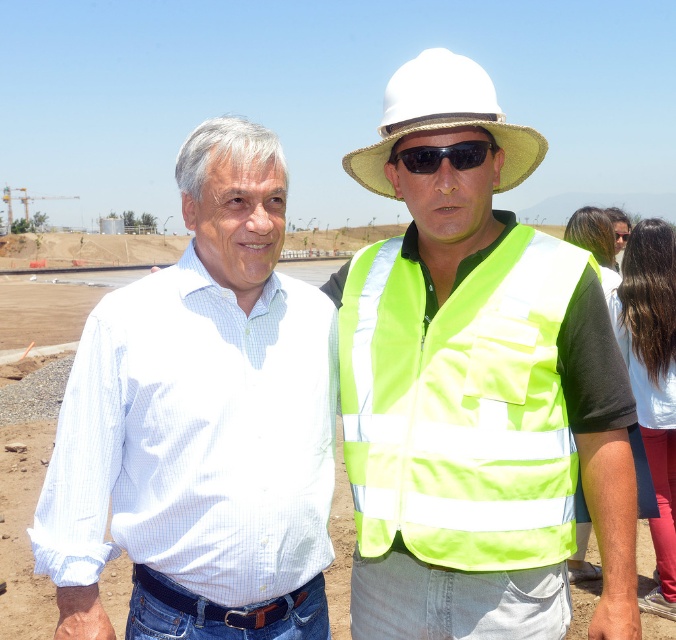
Question: Can you confirm if reflective yellow vest at center is bigger than black reflective sunglasses at center?

Choices:
 (A) yes
 (B) no

Answer: (A)

Question: Which point appears closest to the camera in this image?

Choices:
 (A) (485, 150)
 (B) (518, 131)
 (C) (162, 509)

Answer: (C)

Question: Among these objects, which one is nearest to the camera?

Choices:
 (A) black reflective sunglasses at center
 (B) white checkered shirt at center
 (C) high-visibility fabric safety vest at center
 (D) white straw cowboy hat at upper center

Answer: (B)

Question: Does reflective yellow vest at center have a greater width compared to white checkered shirt at center?

Choices:
 (A) yes
 (B) no

Answer: (B)

Question: Can you confirm if reflective yellow vest at center is positioned above black reflective sunglasses at center?

Choices:
 (A) yes
 (B) no

Answer: (B)

Question: Which point is farther to the camera?

Choices:
 (A) high-visibility fabric safety vest at center
 (B) white straw cowboy hat at upper center

Answer: (B)